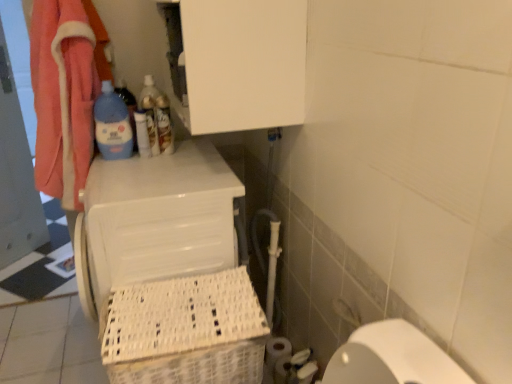
Identify the location of free point in front of translucent plastic bottle at upper center, placed as the 2th bottle when sorted from right to left. (161, 159).